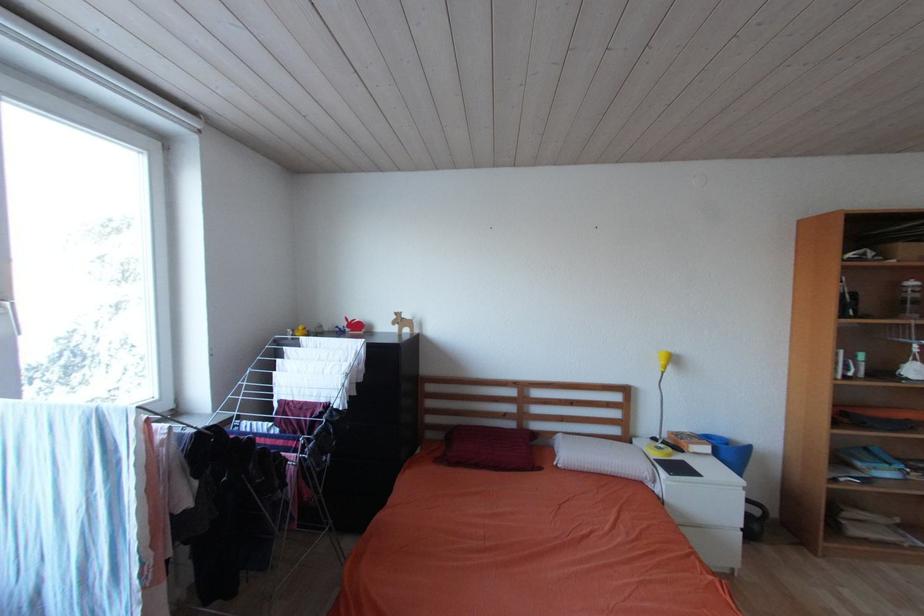
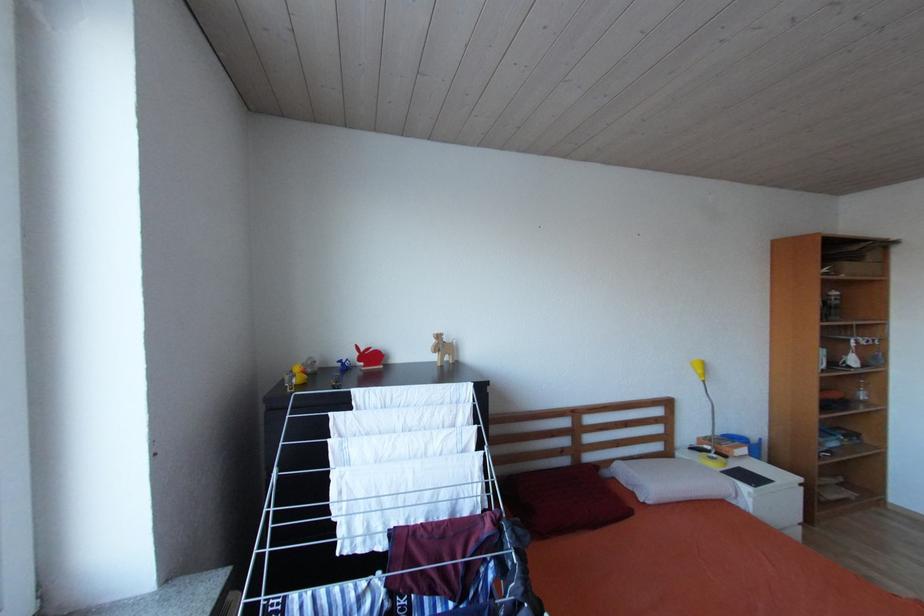
In a continuous first-person perspective shot, in which direction is the camera moving?

The movement direction of the cameraman is left, forward.